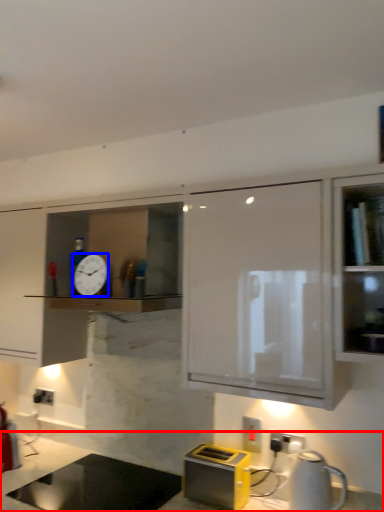
Question: Which of the following is the closest to the observer, countertop (highlighted by a red box) or clock (highlighted by a blue box)?

Choices:
 (A) countertop
 (B) clock

Answer: (A)